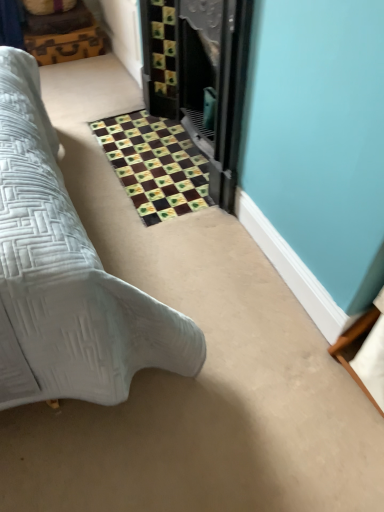
Find the location of a particular element. This screenshot has height=512, width=384. patchwork rug at center is located at coordinates (155, 164).

What do you see at coordinates (155, 164) in the screenshot?
I see `patchwork rug at center` at bounding box center [155, 164].

This screenshot has width=384, height=512. Find the location of `patchwork rug at center`. patchwork rug at center is located at coordinates pos(155,164).